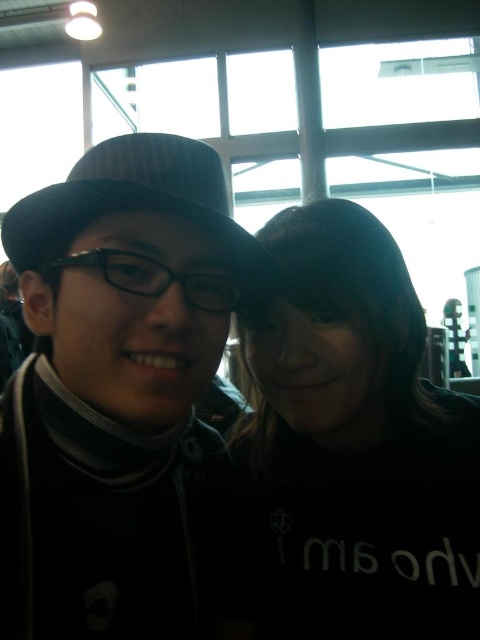
Which is below, matte black hat at left or black matte shirt at center?

black matte shirt at center is lower down.

Is matte black hat at left bigger than black matte shirt at center?

Correct, matte black hat at left is larger in size than black matte shirt at center.

Is point (118, 150) closer to camera compared to point (349, 589)?

Yes, it is.

Where is `matte black hat at left`? The width and height of the screenshot is (480, 640). matte black hat at left is located at coordinates (121, 400).

Between black matte shirt at center and black felt hat at center, which one appears on the left side from the viewer's perspective?

black felt hat at center

Image resolution: width=480 pixels, height=640 pixels. In order to click on black matte shirt at center in this screenshot , I will do click(x=355, y=444).

Is point (132, 408) positioned after point (260, 250)?

No, it is not.

Is matte black hat at left taller than black felt hat at center?

Yes, matte black hat at left is taller than black felt hat at center.

Is point (179, 403) less distant than point (188, 189)?

Yes, point (179, 403) is closer to viewer.

Locate an element on the screen. matte black hat at left is located at coordinates (121, 400).